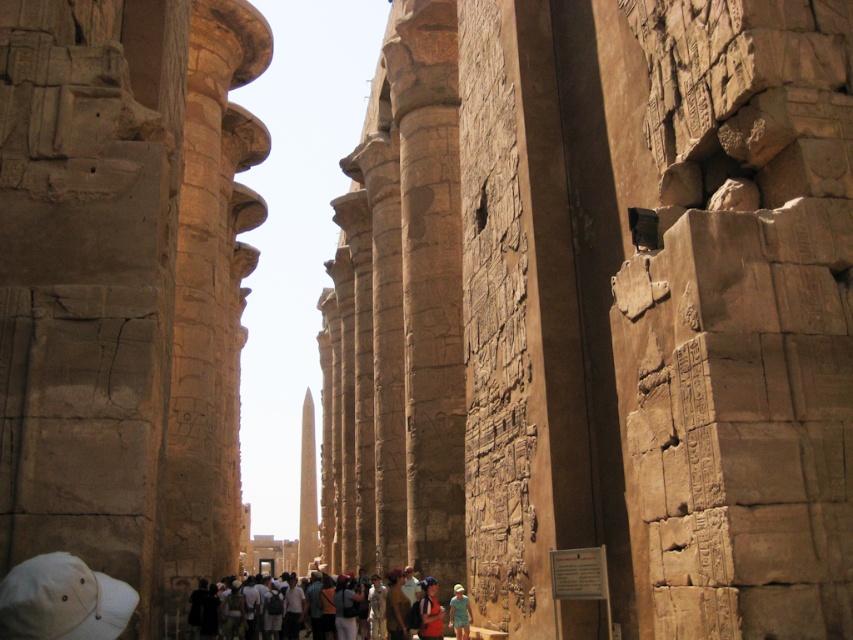
Which of these two, beige stone column at left or light brown fabric backpack at center, stands shorter?

Standing shorter between the two is light brown fabric backpack at center.

Between beige stone column at left and light brown fabric backpack at center, which one is positioned higher?

beige stone column at left is above.

This screenshot has height=640, width=853. Find the location of `beige stone column at left`. beige stone column at left is located at coordinates (125, 285).

The height and width of the screenshot is (640, 853). In order to click on beige stone column at left in this screenshot , I will do `click(125, 285)`.

Does light brown fabric backpack at center appear under green fabric dress at center?

Yes.

Between point (430, 592) and point (467, 605), which one is positioned in front?

Point (467, 605)

Image resolution: width=853 pixels, height=640 pixels. I want to click on light brown fabric backpack at center, so click(x=438, y=612).

Which is behind, point (473, 8) or point (463, 600)?

Positioned behind is point (473, 8).

Can you confirm if beige stone wall at center is positioned to the right of light brown fabric backpack at center?

Incorrect, beige stone wall at center is not on the right side of light brown fabric backpack at center.

This screenshot has width=853, height=640. What do you see at coordinates (601, 310) in the screenshot?
I see `beige stone wall at center` at bounding box center [601, 310].

Locate an element on the screen. Image resolution: width=853 pixels, height=640 pixels. beige stone wall at center is located at coordinates (601, 310).